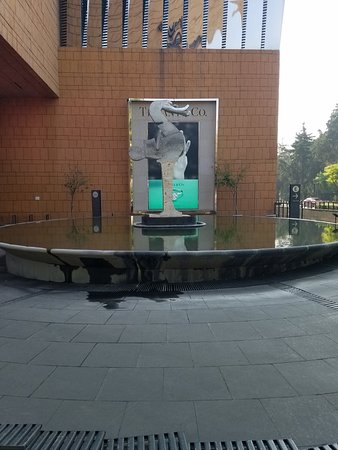
Identify the location of grate. The image size is (338, 450). (251, 444).